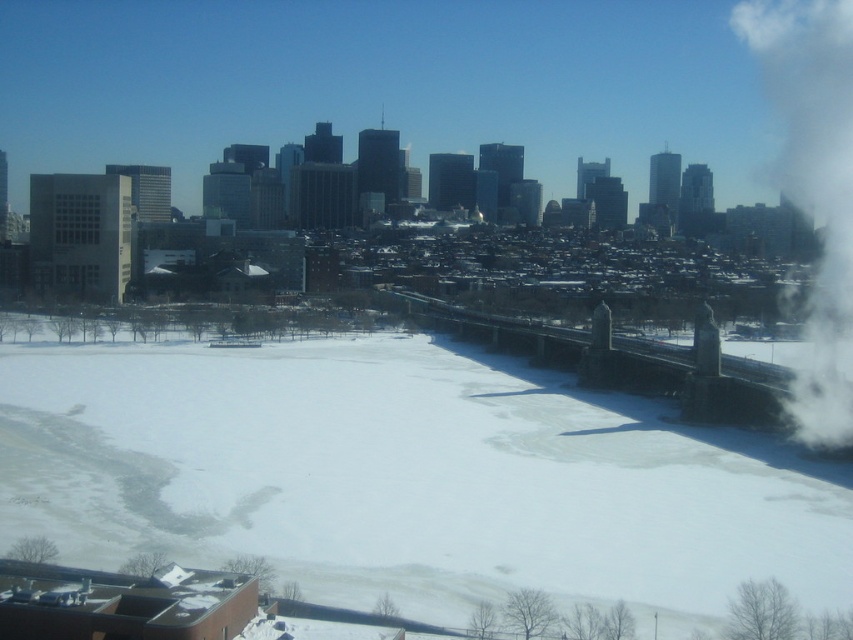
In the scene shown: You are a photographer standing at the edge of the frozen lake. You notice the white powdery snow at center and the white smoke at upper right in your viewfinder. Which of these two elements is positioned lower in the frame?

The white powdery snow at center is located below the white smoke at upper right, so the white powdery snow at center is positioned lower in the frame.

Looking at this image, you are standing at the edge of the frozen lake and see both the white powdery snow at center and the white smoke at upper right. Which one is nearer to you?

The white powdery snow at center is closer to the viewer than the white smoke at upper right.